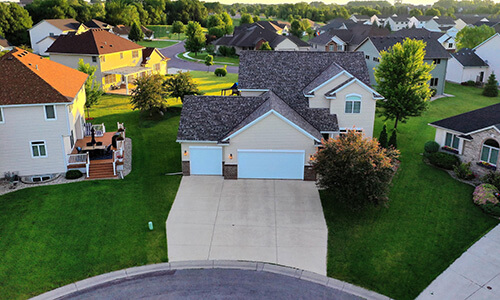
Locate an element on the screen. Image resolution: width=500 pixels, height=300 pixels. window is located at coordinates (353, 109).